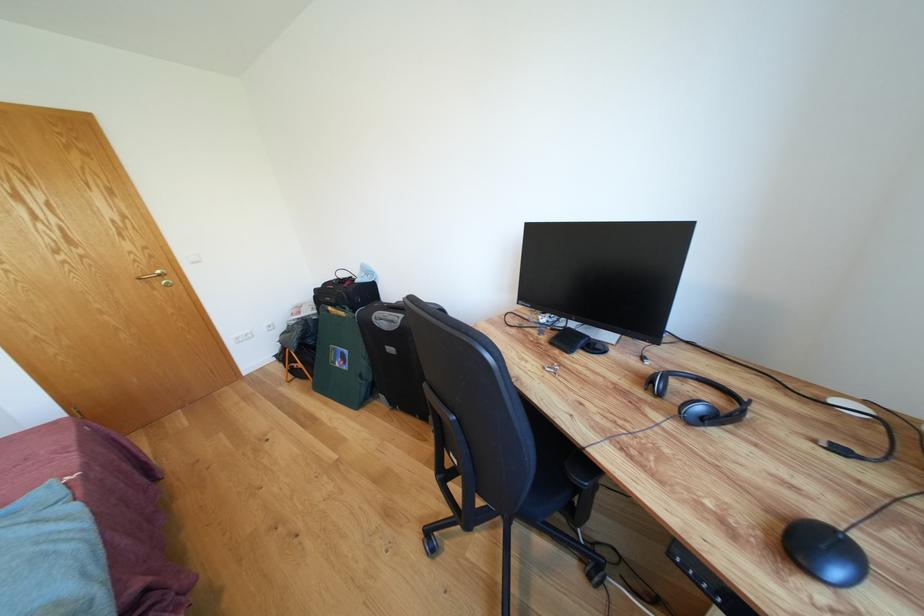
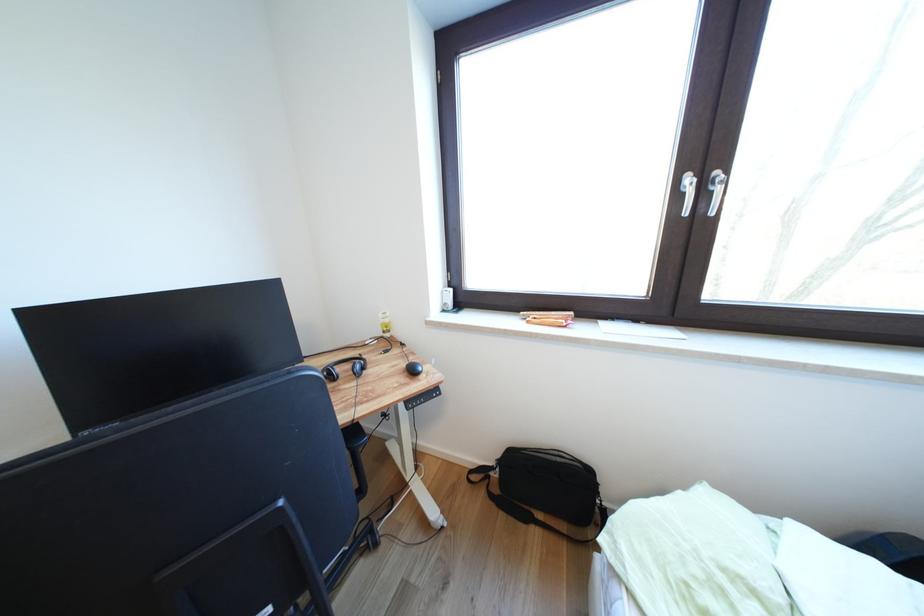
Question: The camera is either moving clockwise (left) or counter-clockwise (right) around the object. The first image is from the beginning of the video and the second image is from the end. Is the camera moving left or right when shooting the video?

Choices:
 (A) Left
 (B) Right

Answer: (A)